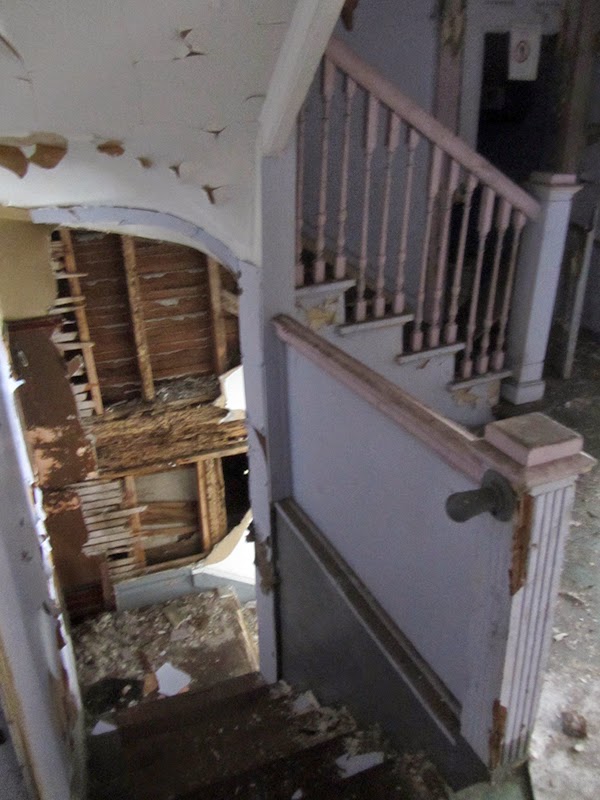
What are the coordinates of `floor` in the screenshot? It's located at (571, 622).